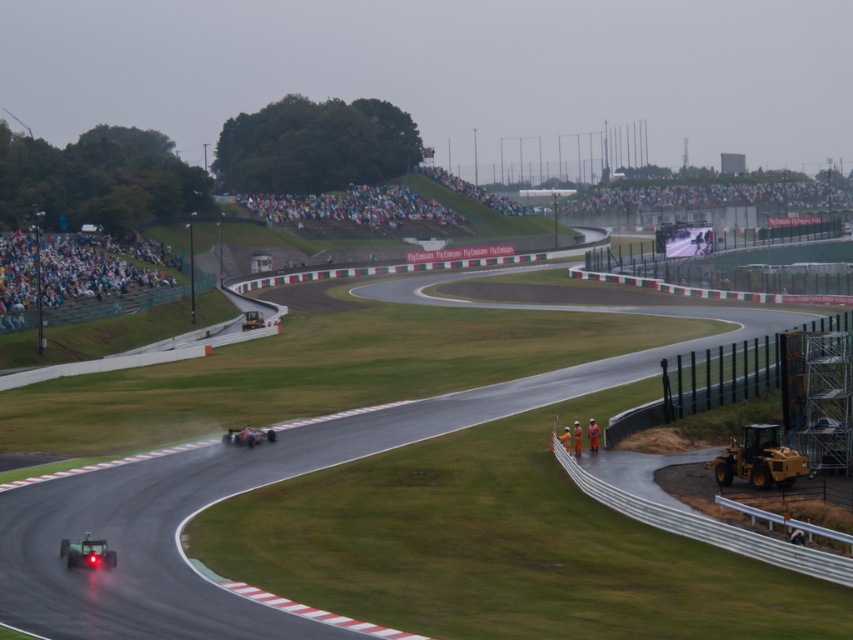
Does green matte race car at lower left have a smaller size compared to shiny metallic race car at center?

Correct, green matte race car at lower left occupies less space than shiny metallic race car at center.

Who is lower down, green matte race car at lower left or shiny metallic race car at center?

Positioned lower is green matte race car at lower left.

Is point (99, 552) more distant than point (250, 442)?

No, it is not.

Where is `green matte race car at lower left`? This screenshot has height=640, width=853. green matte race car at lower left is located at coordinates (86, 552).

Between smooth asphalt race track at center and yellow metallic race car at lower right, which one has more height?

With more height is smooth asphalt race track at center.

Between smooth asphalt race track at center and yellow metallic race car at lower right, which one is positioned higher?

smooth asphalt race track at center is higher up.

You are a GUI agent. You are given a task and a screenshot of the screen. Output one action in this format:
    pyautogui.click(x=<x>, y=<y>)
    Task: Click on the smooth asphalt race track at center
    The width and height of the screenshot is (853, 640).
    Given the screenshot: What is the action you would take?
    pyautogui.click(x=230, y=493)

Can you confirm if yellow metallic race car at lower right is positioned to the left of green matte race car at lower left?

In fact, yellow metallic race car at lower right is to the right of green matte race car at lower left.

Does yellow metallic race car at lower right have a greater height compared to green matte race car at lower left?

Yes, yellow metallic race car at lower right is taller than green matte race car at lower left.

In order to click on yellow metallic race car at lower right in this screenshot , I will do `click(759, 460)`.